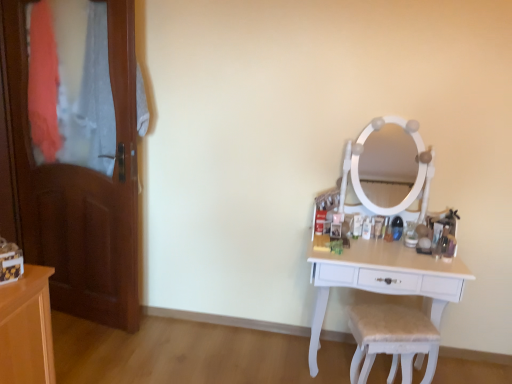
Locate an element on the screen. free region on the left part of white wood table at right is located at coordinates (258, 357).